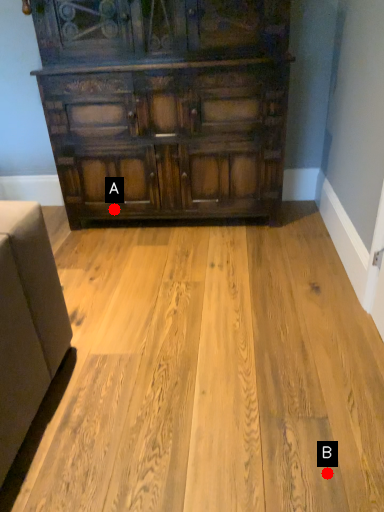
Question: Two points are circled on the image, labeled by A and B beside each circle. Which point is farther from the camera taking this photo?

Choices:
 (A) A is further
 (B) B is further

Answer: (A)